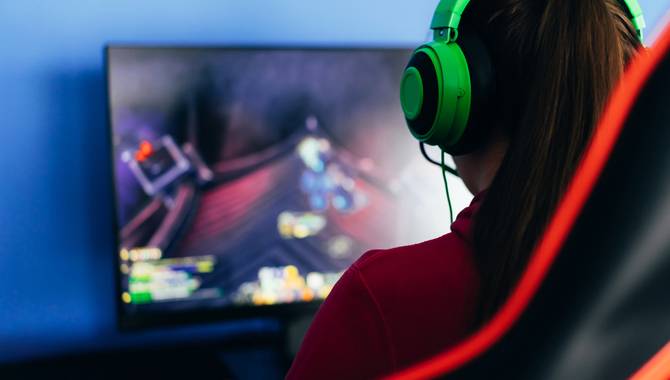
Where is `stand for screen`? The width and height of the screenshot is (670, 380). stand for screen is located at coordinates (291, 327).